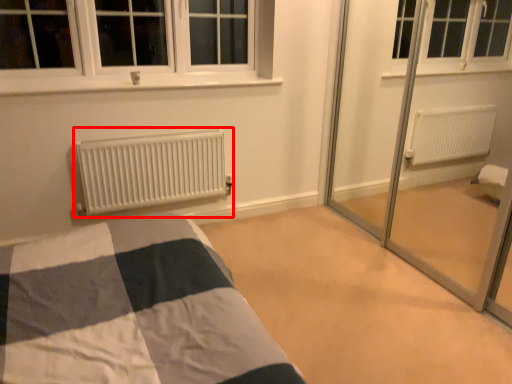
Question: Where is heater (annotated by the red box) located in relation to plain in the image?

Choices:
 (A) right
 (B) left

Answer: (B)